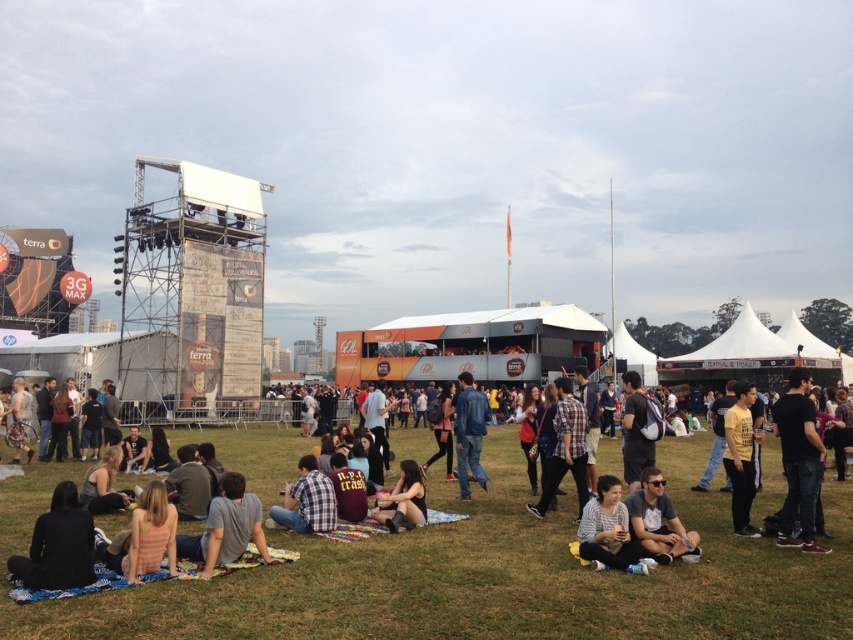
Question: Is black cotton shirt at right above plaid shirt at center?

Choices:
 (A) no
 (B) yes

Answer: (B)

Question: Which of the following is the farthest from the observer?

Choices:
 (A) denim jacket at center
 (B) black cotton shirt at right

Answer: (A)

Question: Can you confirm if denim jacket at lower left is bigger than dark gray casual wear at lower right?

Choices:
 (A) yes
 (B) no

Answer: (A)

Question: Which object is positioned farthest from the black matte jacket at lower left?

Choices:
 (A) black cotton shirt at right
 (B) dark brown leather jacket at center
 (C) denim jacket at center
 (D) dark gray casual wear at lower right

Answer: (A)

Question: Among these objects, which one is farthest from the camera?

Choices:
 (A) black matte jacket at lower left
 (B) dark brown leather jacket at center
 (C) denim jacket at lower left
 (D) matte gray sweater at lower center

Answer: (B)

Question: Can you confirm if yellow matte shirt at center is positioned to the right of dark brown leather jacket at center?

Choices:
 (A) no
 (B) yes

Answer: (B)